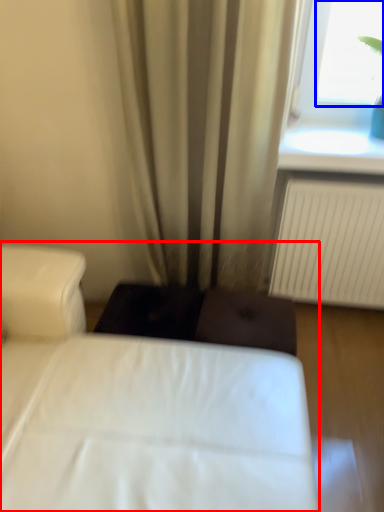
Question: Which point is closer to the camera, bed (highlighted by a red box) or window screen (highlighted by a blue box)?

Choices:
 (A) bed
 (B) window screen

Answer: (A)